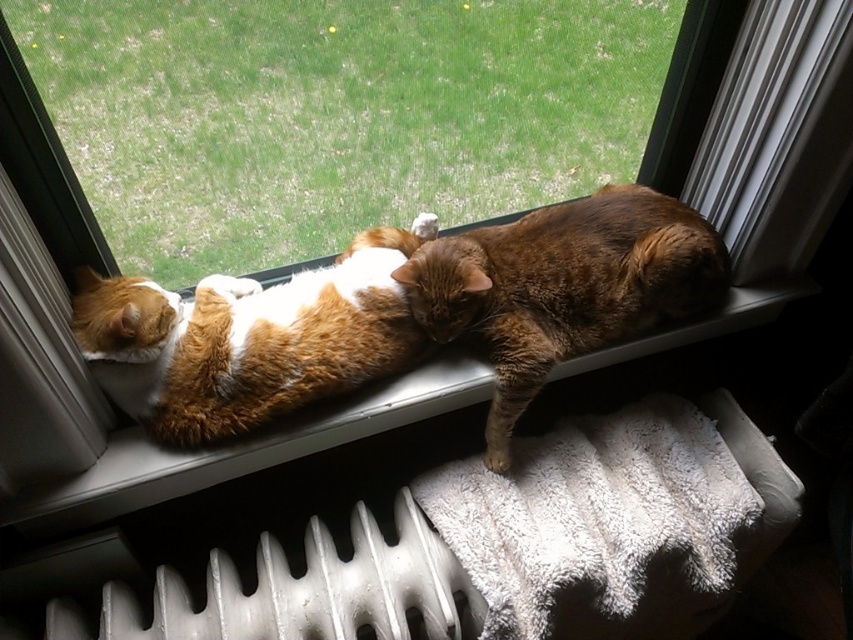
You are a photographer trying to capture a clear photo of the orange fur cat at center and the white textured window sill at center. Which object is positioned closer to the camera lens?

The orange fur cat at center is closer to the viewer than the white textured window sill at center, so it will appear closer to the camera lens.

You are standing in front of the window and want to place a small plant pot between the tabby fur cat at center and another object. Which object is the cat positioned closest to?

The tabby fur cat at center is located at point (563, 285), so it is closest to the object at that coordinate.